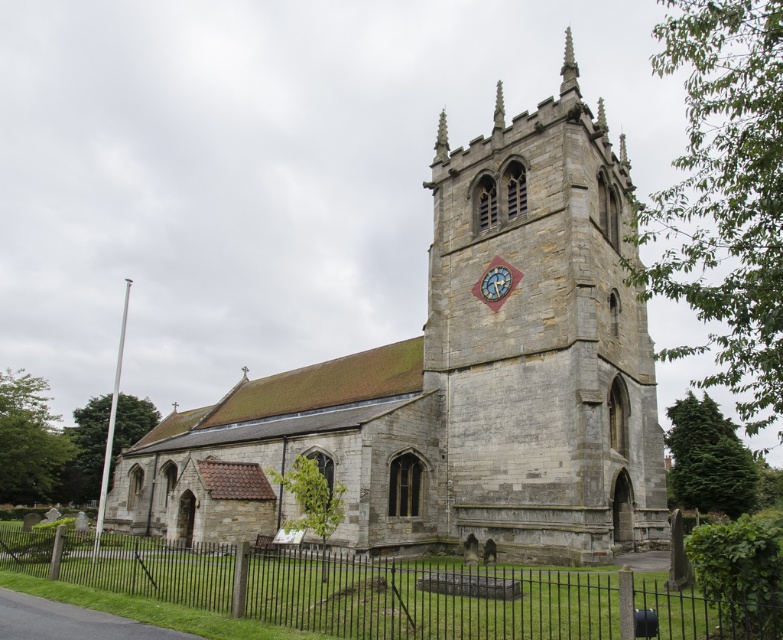
Does point (493, 289) come behind point (442, 124)?

No, (493, 289) is in front of (442, 124).

Which is behind, point (498, 296) or point (446, 132)?

The point (446, 132) is more distant.

The width and height of the screenshot is (783, 640). What are the coordinates of `blue painted wood clock at upper right` in the screenshot? It's located at (495, 282).

Which of these two, black wrought iron fence at lower center or blue painted wood clock at upper right, stands shorter?

Standing shorter between the two is blue painted wood clock at upper right.

Is point (500, 605) positioned behind point (500, 288)?

No, it is in front of (500, 288).

Locate an element on the screen. This screenshot has width=783, height=640. black wrought iron fence at lower center is located at coordinates (482, 600).

The image size is (783, 640). What are the coordinates of `black wrought iron fence at lower center` in the screenshot? It's located at click(482, 600).

Is gray stone church at center positioned before black wrought iron fence at lower center?

No, it is not.

At what (x,y) coordinates should I click in order to perform the action: click on gray stone church at center. Please return your answer as a coordinate pair (x, y). Looking at the image, I should click on (462, 380).

Does point (583, 170) lie behind point (412, 634)?

Yes, it is.

Locate an element on the screen. The width and height of the screenshot is (783, 640). gray stone church at center is located at coordinates (462, 380).